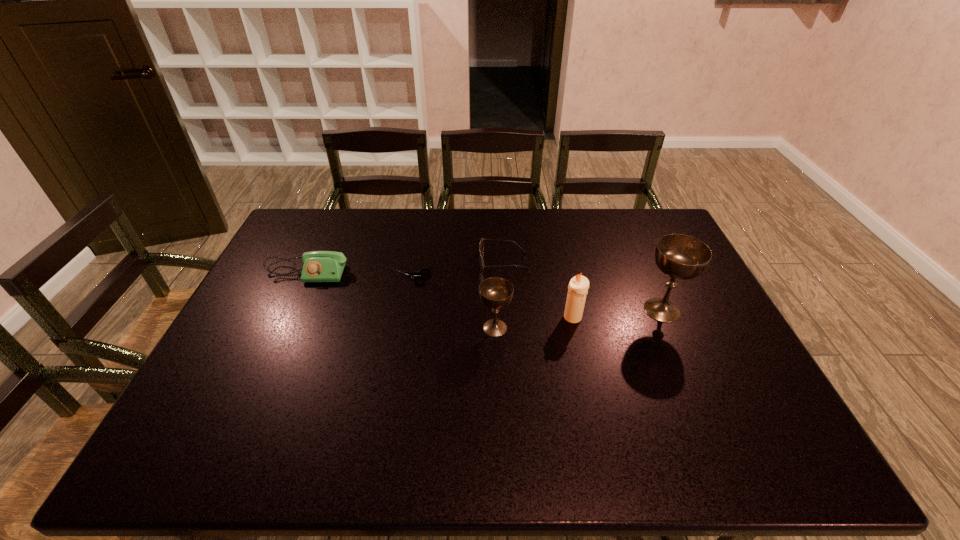
The width and height of the screenshot is (960, 540). I want to click on vacant space at the near edge, so click(348, 420).

At what (x,y) coordinates should I click in order to perform the action: click on free point at the left edge. Please return your answer as a coordinate pair (x, y). This screenshot has height=540, width=960. Looking at the image, I should click on (248, 353).

At what (x,y) coordinates should I click in order to perform the action: click on blank space at the right edge. Please return your answer as a coordinate pair (x, y). This screenshot has width=960, height=540. Looking at the image, I should click on (694, 315).

At what (x,y) coordinates should I click in order to perform the action: click on free space at the far left corner. Please return your answer as a coordinate pair (x, y). This screenshot has height=540, width=960. Looking at the image, I should click on (310, 224).

Identify the location of vacant space at the near left corner of the desktop. The height and width of the screenshot is (540, 960). click(x=190, y=418).

The width and height of the screenshot is (960, 540). In the image, there is a desktop. Identify the location of vacant space at the far right corner. (632, 232).

Locate an element on the screen. This screenshot has height=540, width=960. free spot between the shorter chalice and the shears is located at coordinates (454, 303).

Identify the location of vacant space that is in between the left chalice and the fifth object from left to right. Image resolution: width=960 pixels, height=540 pixels. (534, 322).

Where is `free point between the fifth object from left to right and the second shortest object`? free point between the fifth object from left to right and the second shortest object is located at coordinates (538, 289).

Locate an element on the screen. free space that is in between the shorter chalice and the shortest object is located at coordinates (454, 303).